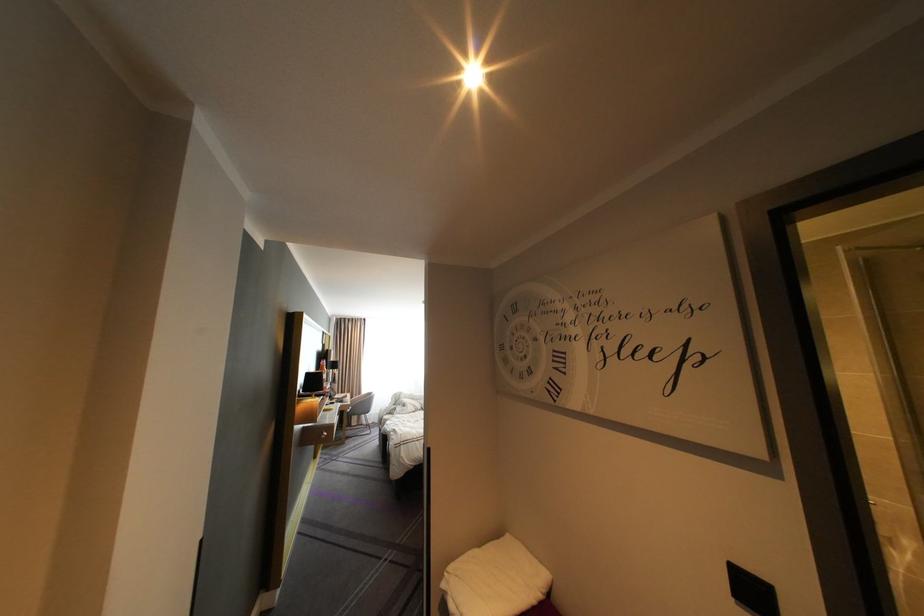
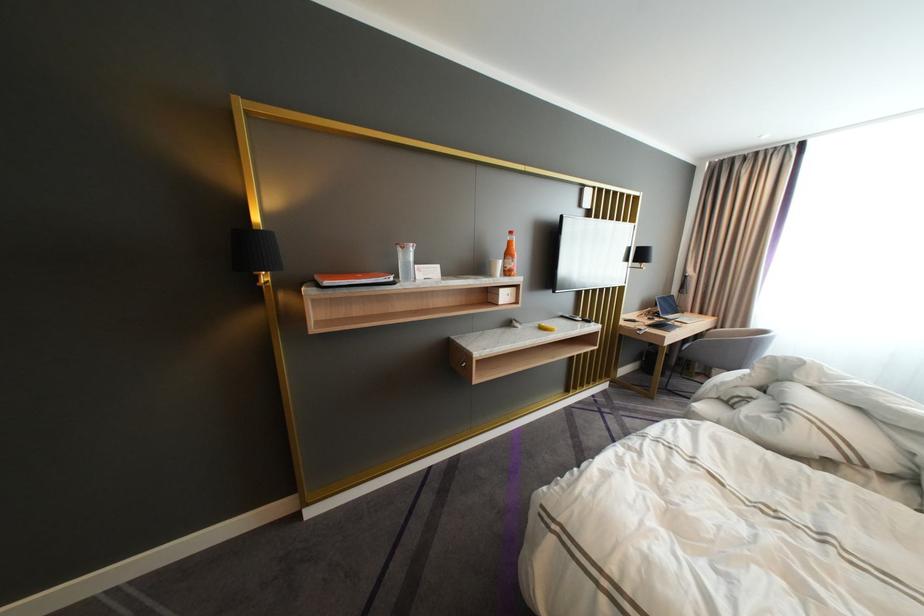
Find the pixel in the second image that matches point (348, 398) in the first image.

(683, 317)